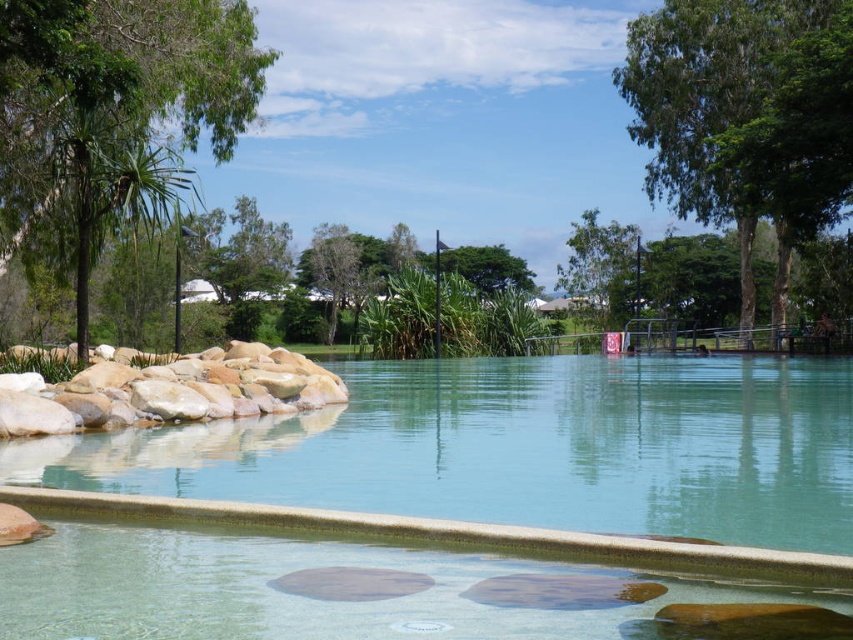
Which of these two, smooth beige rock at left or green leafy tree at upper center, stands shorter?

With less height is smooth beige rock at left.

Is smooth beige rock at left further to the viewer compared to green leafy tree at upper center?

No, smooth beige rock at left is closer to the viewer.

Which is in front, point (178, 358) or point (611, 291)?

Point (178, 358) is more forward.

Locate an element on the screen. Image resolution: width=853 pixels, height=640 pixels. smooth beige rock at left is located at coordinates (167, 390).

Based on the photo, is smooth beige rock at left thinner than green leafy tree at center?

Yes, smooth beige rock at left is thinner than green leafy tree at center.

Does smooth beige rock at left have a greater width compared to green leafy tree at center?

No.

Identify the location of smooth beige rock at left. (167, 390).

Does green leafy tree at left have a greater height compared to green leafy tree at upper center?

No.

Is green leafy tree at left smaller than green leafy tree at upper center?

Yes, green leafy tree at left is smaller than green leafy tree at upper center.

Is point (99, 164) farther from camera compared to point (619, 268)?

No, it is in front of (619, 268).

At what (x,y) coordinates should I click in order to perform the action: click on green leafy tree at left. Please return your answer as a coordinate pair (x, y). This screenshot has height=640, width=853. Looking at the image, I should click on (112, 115).